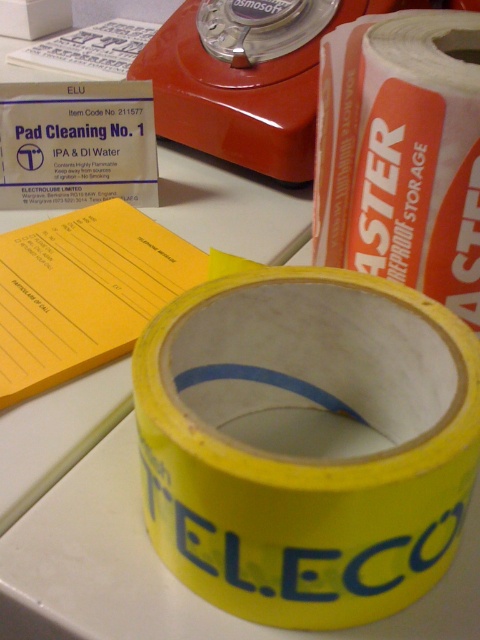
Question: Does yellow matte adhesive tape at center appear under matte plastic stapler at upper center?

Choices:
 (A) yes
 (B) no

Answer: (A)

Question: Which object appears closest to the camera in this image?

Choices:
 (A) matte plastic stapler at upper center
 (B) yellow matte adhesive tape at center

Answer: (B)

Question: Does yellow matte adhesive tape at center appear under matte plastic stapler at upper center?

Choices:
 (A) yes
 (B) no

Answer: (A)

Question: Is yellow matte adhesive tape at center to the left of matte plastic stapler at upper center from the viewer's perspective?

Choices:
 (A) no
 (B) yes

Answer: (A)